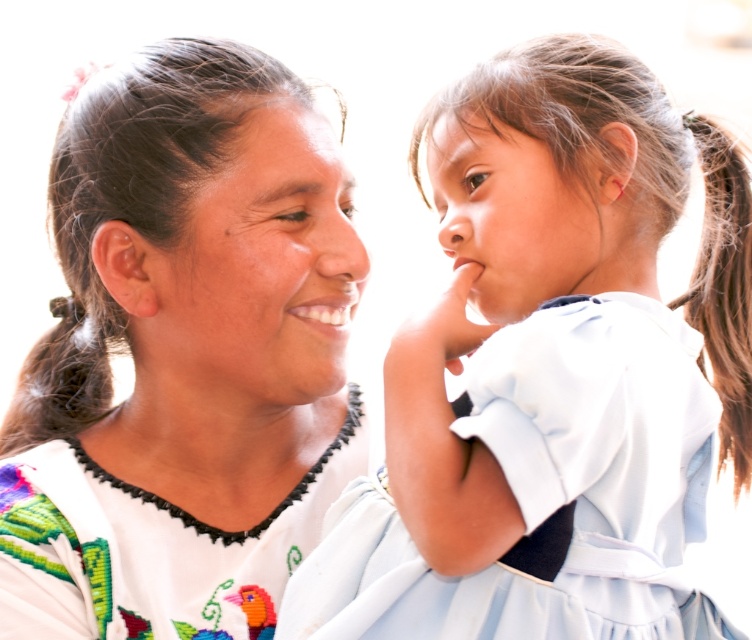
You are an anthropologist studying traditional clothing. You observe the light blue fabric dress at upper right and the white embroidered dress at center in the scene. Which dress is positioned higher in the image?

The light blue fabric dress at upper right is taller than the white embroidered dress at center, so it is positioned higher in the image.

You are a photographer setting up a shot of the scene described. You need to ensure that the light blue fabric dress at upper right and the white embroidered dress at center are both in focus. Given that your camera has a depth of field that can cover 15 inches, will both dresses be in focus?

The light blue fabric dress at upper right is 14.49 inches away from the white embroidered dress at center. Since the distance between them is less than the camera depth of field of 15 inches, both dresses will be in focus.